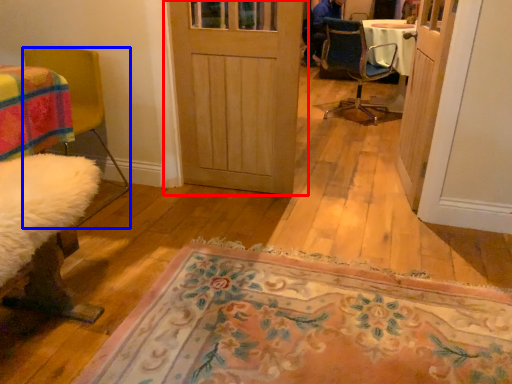
Question: Which point is closer to the camera, door (highlighted by a red box) or chair (highlighted by a blue box)?

Choices:
 (A) door
 (B) chair

Answer: (B)